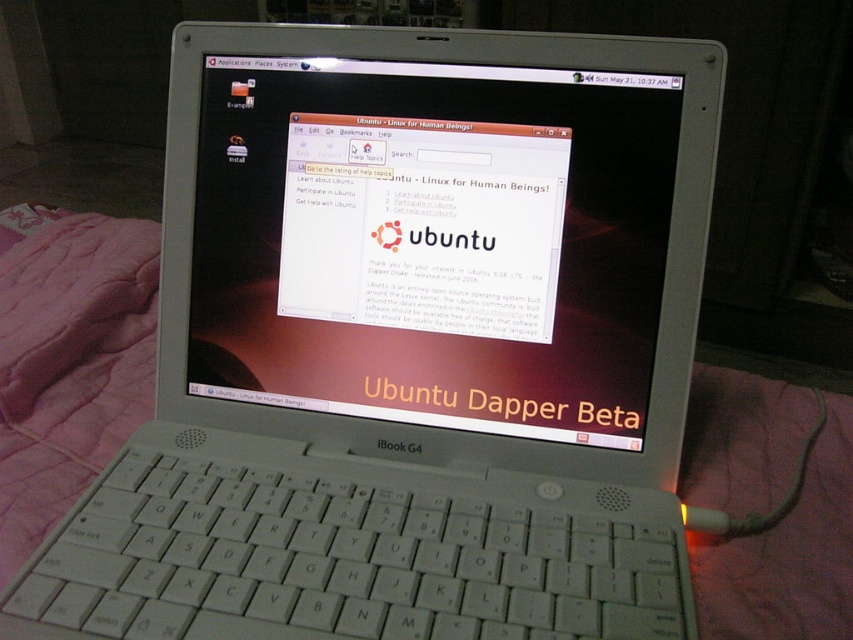
Question: Among these objects, which one is nearest to the camera?

Choices:
 (A) white glossy laptop screen at center
 (B) pink quilted blanket at left

Answer: (B)

Question: Does white glossy laptop screen at center have a greater width compared to pink quilted blanket at left?

Choices:
 (A) yes
 (B) no

Answer: (A)

Question: Does white glossy laptop screen at center appear on the left side of pink quilted blanket at left?

Choices:
 (A) no
 (B) yes

Answer: (A)

Question: Can you confirm if white glossy laptop screen at center is smaller than pink quilted blanket at left?

Choices:
 (A) no
 (B) yes

Answer: (B)

Question: Which of the following is the closest to the observer?

Choices:
 (A) pink quilted blanket at left
 (B) white glossy laptop screen at center

Answer: (A)